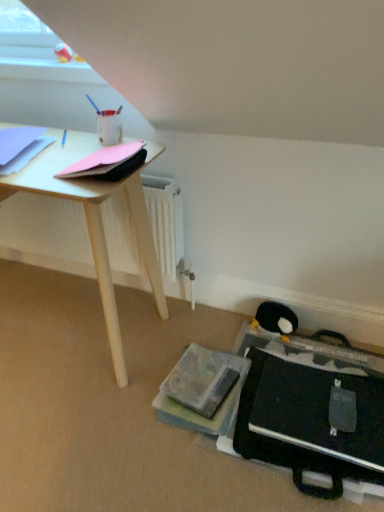
Question: From the image's perspective, is pink matte paper at upper left, which appears as the 1th paperback book when viewed from the right, positioned above or below black plush penguin at lower right?

Choices:
 (A) above
 (B) below

Answer: (A)

Question: Is pink matte paper at upper left, which appears as the 1th paperback book when viewed from the right, wider or thinner than black plush penguin at lower right?

Choices:
 (A) wide
 (B) thin

Answer: (A)

Question: Which of these objects is positioned closest to the black plush penguin at lower right?

Choices:
 (A) pink matte paper at upper left, which appears as the 1th paperback book when viewed from the right
 (B) light blue paper at upper left, which is counted as the second paperback book, starting from the right

Answer: (A)

Question: Which object is positioned closest to the light blue paper at upper left, which is the 1th paperback book in left-to-right order?

Choices:
 (A) black plush penguin at lower right
 (B) pink matte paper at upper left, which appears as the 1th paperback book when viewed from the right

Answer: (B)